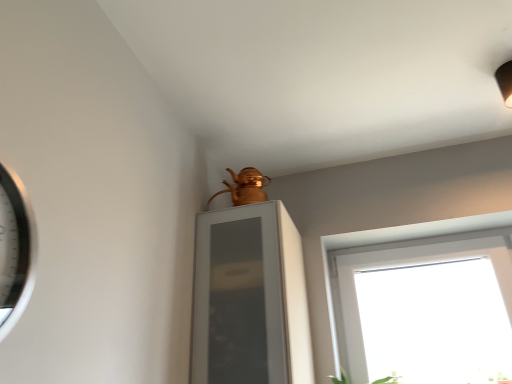
Image resolution: width=512 pixels, height=384 pixels. Find the location of `matte gold medicine cabinet at upper center`. matte gold medicine cabinet at upper center is located at coordinates (255, 288).

In order to face matte gold medicine cabinet at upper center, should I rotate leftwards or rightwards?

Turn right by 0.387 degrees to look at matte gold medicine cabinet at upper center.

Image resolution: width=512 pixels, height=384 pixels. Describe the element at coordinates (255, 288) in the screenshot. I see `matte gold medicine cabinet at upper center` at that location.

At what (x,y) coordinates should I click in order to perform the action: click on matte gold medicine cabinet at upper center. Please return your answer as a coordinate pair (x, y). This screenshot has width=512, height=384. Looking at the image, I should click on (255, 288).